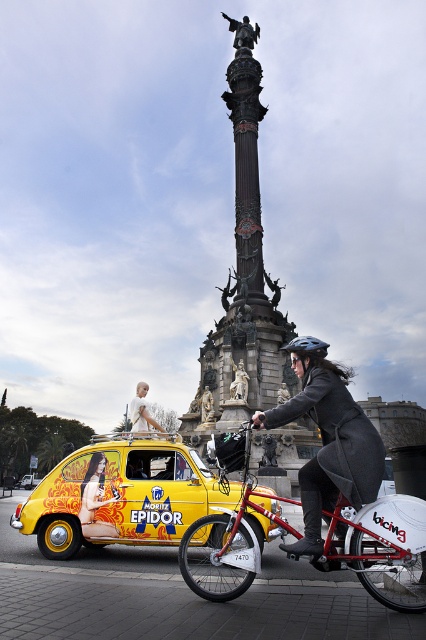
You are a pedestrian standing at the crosswalk and want to cross the street safely. You see a yellow matte taxi at center and a metallic red bicycle at center. Which one is closer to you?

The yellow matte taxi at center is closer to you since it is further to the viewer than the metallic red bicycle at center.

You are a tourist standing at the starting point of the route and want to reach the yellow matte taxi at center. According to the map coordinates, the starting point is at point 0.5, 0.5. In which direction should you move to reach the taxi?

The yellow matte taxi at center is located at point (121, 496). Since the starting point is at (213, 320), you should move towards the northeast direction to reach the taxi.

You are standing at the starting point and need to reach the endpoint. The path goes through two checkpoints marked by point 1 at coordinates point (310, 563) and point 2 at coordinates point (307, 348). Which checkpoint should you reach first?

You should reach point 1 at coordinates point (310, 563) first because it is in front of point 2 at coordinates point (307, 348) along the path.